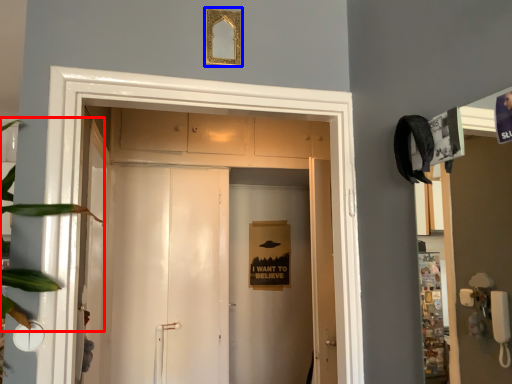
Question: Which object appears closest to the camera in this image, plant (highlighted by a red box) or picture frame (highlighted by a blue box)?

Choices:
 (A) plant
 (B) picture frame

Answer: (A)